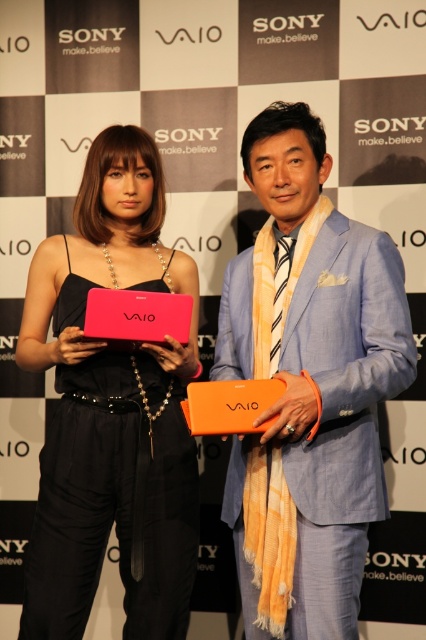
You are standing in front of the Sony VAIO backdrop and want to place a small sticker on the point that is closer to the camera. Which point should you choose between point (351, 358) and point (32, 292)?

Point (351, 358) is in front of point (32, 292), so you should choose point (351, 358) to place the sticker as it is closer to the camera.

You are designing a layout for a poster and need to place both the orange fabric scarf at center and the matte pink laptop at center. Given their sizes, which object should you place first to ensure proper scaling?

The orange fabric scarf at center is larger in size than the matte pink laptop at center, so you should place the orange fabric scarf at center first to ensure proper scaling.

You are a photographer setting up a shoot with two models standing side by side. The backdrop has a Sony VAIO logo and a checkered pattern. The woman on the left holds a bright pink VAIO laptop, and the man on the right wears an orange fabric scarf at center. The orange fabric scarf at center is represented by point (308, 385). You need to adjust the lighting so that the scarf is illuminated more than the laptop. Which object should you focus the light on based on their positions?

The orange fabric scarf at center is represented by point (308, 385), so you should focus the light on the orange fabric scarf at center to ensure it is illuminated more than the bright pink VAIO laptop.